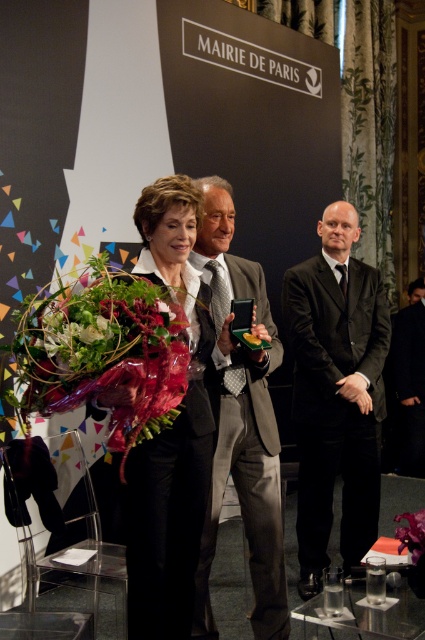
Based on the photo, does matte silver phone at center appear on the left side of gray suit at center?

Indeed, matte silver phone at center is positioned on the left side of gray suit at center.

Can you confirm if matte silver phone at center is bigger than gray suit at center?

Yes.

In order to click on matte silver phone at center in this screenshot , I will do `click(240, 426)`.

Identify the location of matte silver phone at center. This screenshot has width=425, height=640. (240, 426).

Which is more to the right, matte black suit at center or translucent plastic bouquet at left?

From the viewer's perspective, matte black suit at center appears more on the right side.

Is point (161, 465) positioned after point (56, 346)?

That is True.

I want to click on matte black suit at center, so click(x=170, y=429).

In the scene shown: Is black suit at center below green leafy bouquet at center?

Correct, black suit at center is located below green leafy bouquet at center.

Is black suit at center above green leafy bouquet at center?

Actually, black suit at center is below green leafy bouquet at center.

Does point (326, 419) come closer to viewer compared to point (93, 326)?

No, (326, 419) is behind (93, 326).

Image resolution: width=425 pixels, height=640 pixels. I want to click on black suit at center, so click(x=336, y=392).